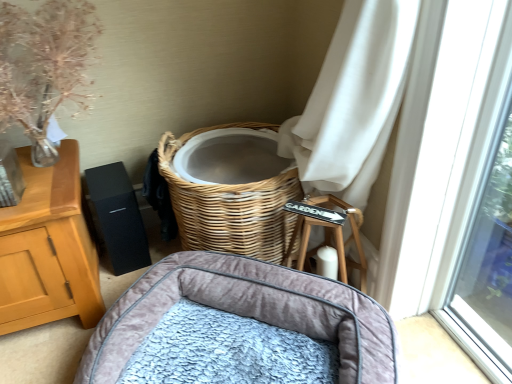
Question: From a real-world perspective, is velvet grey pet bed at lower center over translucent glass vase at upper left?

Choices:
 (A) yes
 (B) no

Answer: (B)

Question: Does velvet grey pet bed at lower center contain translucent glass vase at upper left?

Choices:
 (A) no
 (B) yes

Answer: (A)

Question: Is velvet grey pet bed at lower center at the left side of translucent glass vase at upper left?

Choices:
 (A) yes
 (B) no

Answer: (B)

Question: Considering the relative sizes of velvet grey pet bed at lower center and translucent glass vase at upper left in the image provided, is velvet grey pet bed at lower center shorter than translucent glass vase at upper left?

Choices:
 (A) yes
 (B) no

Answer: (A)

Question: From the image's perspective, is velvet grey pet bed at lower center under translucent glass vase at upper left?

Choices:
 (A) no
 (B) yes

Answer: (B)

Question: Can you confirm if velvet grey pet bed at lower center is smaller than translucent glass vase at upper left?

Choices:
 (A) yes
 (B) no

Answer: (B)

Question: Is translucent glass vase at upper left to the right of velvet grey pet bed at lower center from the viewer's perspective?

Choices:
 (A) yes
 (B) no

Answer: (B)

Question: Does translucent glass vase at upper left have a lesser width compared to velvet grey pet bed at lower center?

Choices:
 (A) no
 (B) yes

Answer: (B)

Question: Does translucent glass vase at upper left have a greater height compared to velvet grey pet bed at lower center?

Choices:
 (A) yes
 (B) no

Answer: (A)

Question: Is translucent glass vase at upper left at the left side of velvet grey pet bed at lower center?

Choices:
 (A) no
 (B) yes

Answer: (B)

Question: From the image's perspective, is translucent glass vase at upper left above velvet grey pet bed at lower center?

Choices:
 (A) yes
 (B) no

Answer: (A)

Question: From the image's perspective, does translucent glass vase at upper left appear lower than velvet grey pet bed at lower center?

Choices:
 (A) no
 (B) yes

Answer: (A)

Question: Is point (84, 67) closer or farther from the camera than point (281, 350)?

Choices:
 (A) farther
 (B) closer

Answer: (A)